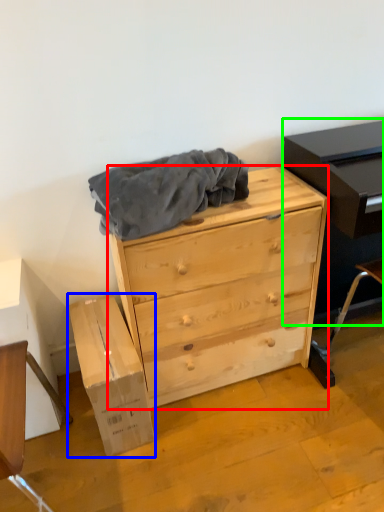
Question: Which is farther away from chest of drawers (highlighted by a red box)? cardboard box (highlighted by a blue box) or entertainment center (highlighted by a green box)?

Choices:
 (A) cardboard box
 (B) entertainment center

Answer: (A)